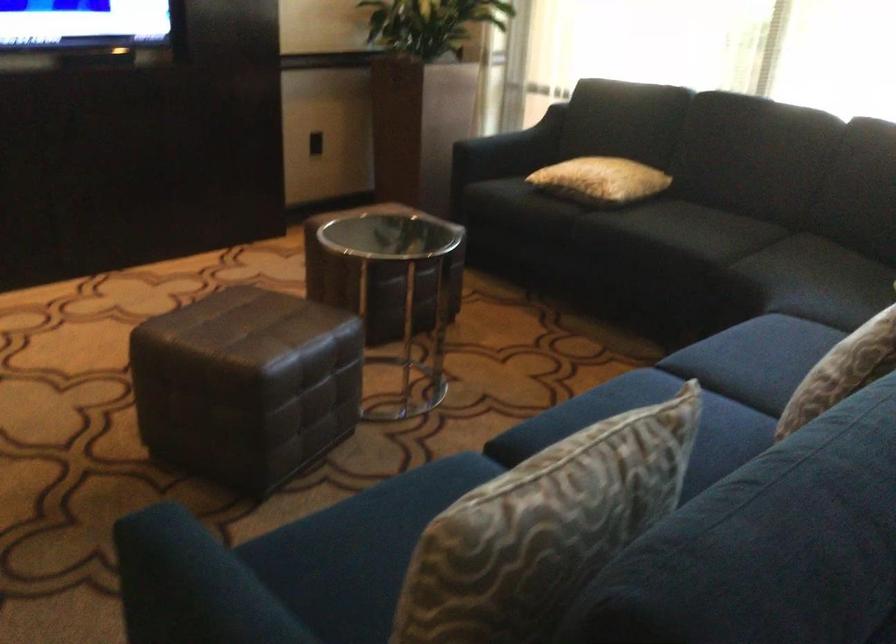
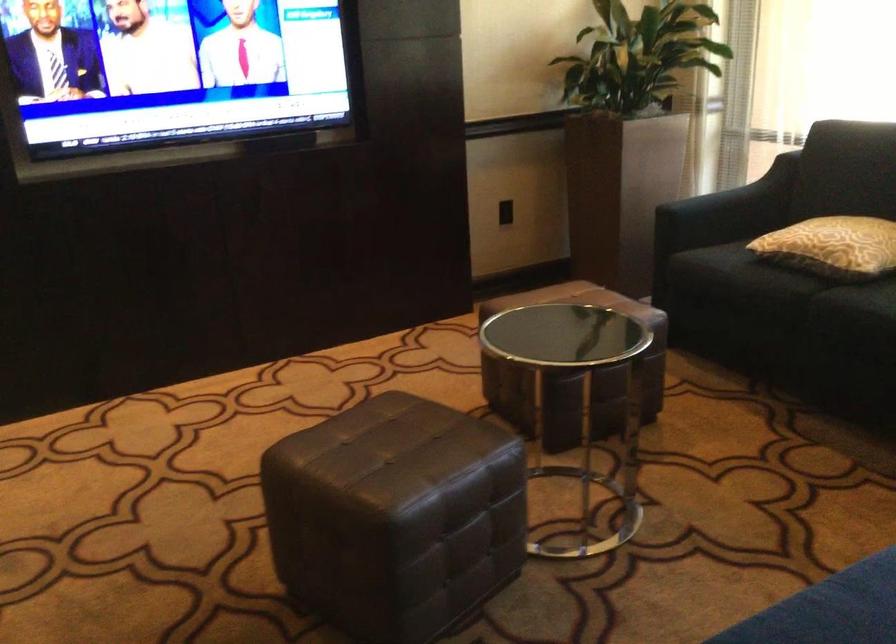
The point at (392, 277) is marked in the first image. Where is the corresponding point in the second image?

(573, 373)